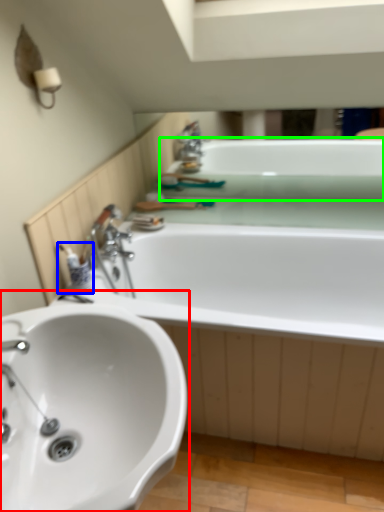
Question: Which object is the farthest from sink (highlighted by a red box)? Choose among these: toiletry (highlighted by a blue box) or bath (highlighted by a green box).

Choices:
 (A) toiletry
 (B) bath

Answer: (B)